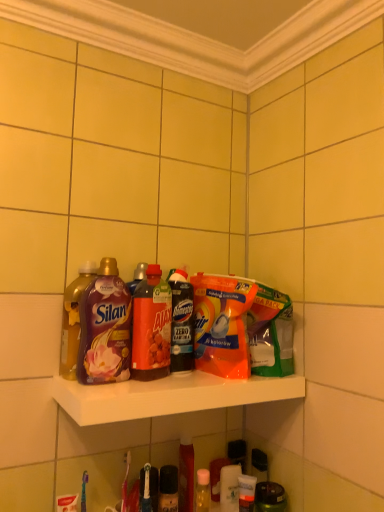
Locate an element on the screen. free space in front of translucent orange bottle at center, arranged as the third bottle when viewed from the left is located at coordinates (136, 386).